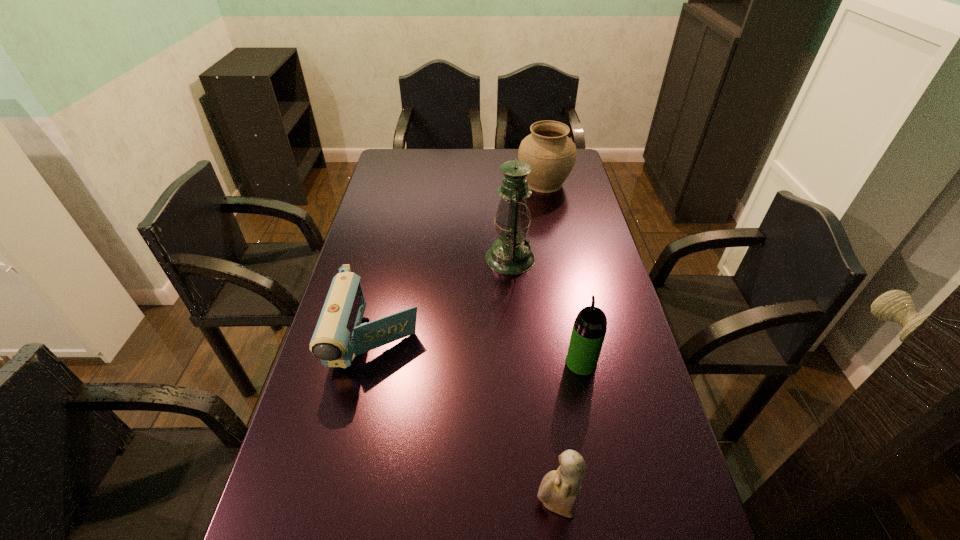
You are a GUI agent. You are given a task and a screenshot of the screen. Output one action in this format:
    pyautogui.click(x=<x>, y=<y>)
    Task: Click on the object that is at the far right corner
    
    Given the screenshot: What is the action you would take?
    pyautogui.click(x=551, y=154)

In the image, there is a desktop. Where is `vacant space at the far edge`? vacant space at the far edge is located at coordinates (431, 162).

Where is `vacant space at the left edge of the desktop`? vacant space at the left edge of the desktop is located at coordinates (361, 398).

In the image, there is a desktop. Identify the location of vacant space at the right edge. The width and height of the screenshot is (960, 540). (586, 380).

Locate an element on the screen. Image resolution: width=960 pixels, height=540 pixels. empty space between the thermos bottle and the nearest object is located at coordinates (568, 434).

This screenshot has height=540, width=960. I want to click on free spot between the thermos bottle and the urn, so click(563, 273).

Image resolution: width=960 pixels, height=540 pixels. In order to click on empty location between the leftmost object and the oil lamp in this screenshot , I will do (x=444, y=299).

Where is `vacant point located between the figurine and the thermos bottle`? vacant point located between the figurine and the thermos bottle is located at coordinates tap(568, 434).

What are the coordinates of `free space between the shortest object and the thermos bottle` in the screenshot? It's located at (479, 351).

You are a GUI agent. You are given a task and a screenshot of the screen. Output one action in this format:
    pyautogui.click(x=<x>, y=<y>)
    Task: Click on the empty space between the shortest object and the oil lamp
    This screenshot has height=540, width=960.
    Given the screenshot: What is the action you would take?
    click(444, 299)